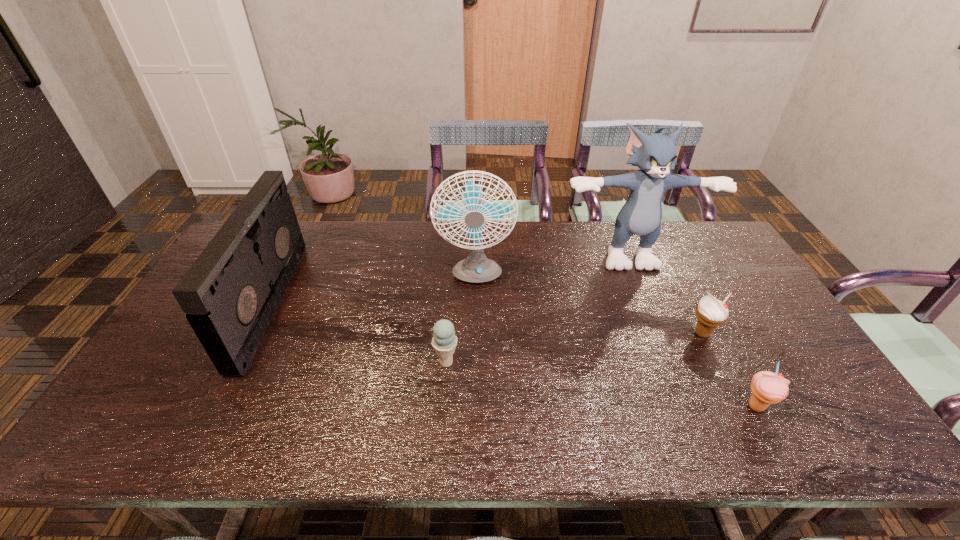
Locate an element on the screen. The width and height of the screenshot is (960, 540). blank area located 0.140m on the left of the leftmost icecream is located at coordinates (380, 362).

The image size is (960, 540). I want to click on free space located on the left of the farthest icecream, so click(x=630, y=334).

Identify the location of vacant space located on the right of the nearest object. This screenshot has height=540, width=960. click(838, 407).

You are a GUI agent. You are given a task and a screenshot of the screen. Output one action in this format:
    pyautogui.click(x=<x>, y=<y>)
    Task: Click on the cat at the far edge
    This screenshot has width=960, height=540.
    Given the screenshot: What is the action you would take?
    pyautogui.click(x=655, y=155)

Where is `videotape located at the far edge`? This screenshot has width=960, height=540. videotape located at the far edge is located at coordinates (230, 293).

This screenshot has width=960, height=540. What are the coordinates of `object that is at the near edge` in the screenshot? It's located at 768,388.

Where is `cat present at the right edge`? cat present at the right edge is located at coordinates click(x=655, y=155).

I want to click on icecream located at the right edge, so click(768, 388).

Find the location of `object that is at the far right corner`. object that is at the far right corner is located at coordinates (655, 155).

Locate an element on the screen. This screenshot has width=960, height=540. object that is at the near right corner is located at coordinates (768, 388).